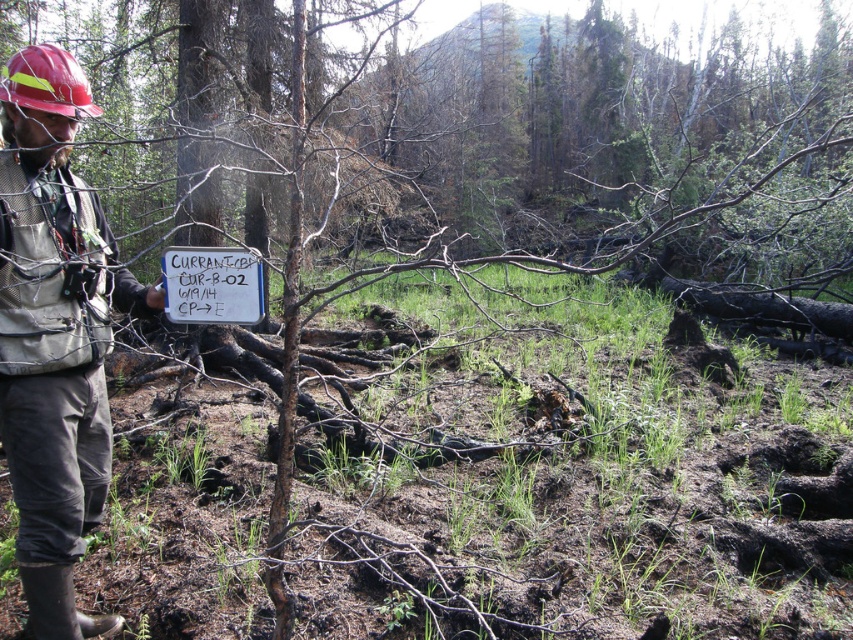
Between hard hat at left and white paper sign at center, which one appears on the right side from the viewer's perspective?

Positioned to the right is white paper sign at center.

Is hard hat at left below white paper sign at center?

Yes, hard hat at left is below white paper sign at center.

Is point (41, 522) in front of point (247, 278)?

That is False.

Identify the location of hard hat at left. 54,333.

Between hard hat at left and red hard hat at upper left, which one has more height?

Standing taller between the two is hard hat at left.

Which is more to the left, hard hat at left or red hard hat at upper left?

red hard hat at upper left

This screenshot has width=853, height=640. What do you see at coordinates (54, 333) in the screenshot?
I see `hard hat at left` at bounding box center [54, 333].

The width and height of the screenshot is (853, 640). What are the coordinates of `hard hat at left` in the screenshot? It's located at (54, 333).

Is white paper sign at center below red hard hat at upper left?

Correct, white paper sign at center is located below red hard hat at upper left.

Where is `white paper sign at center`? The image size is (853, 640). white paper sign at center is located at coordinates (212, 284).

The height and width of the screenshot is (640, 853). In order to click on white paper sign at center in this screenshot , I will do `click(212, 284)`.

This screenshot has height=640, width=853. Identify the location of white paper sign at center. (212, 284).